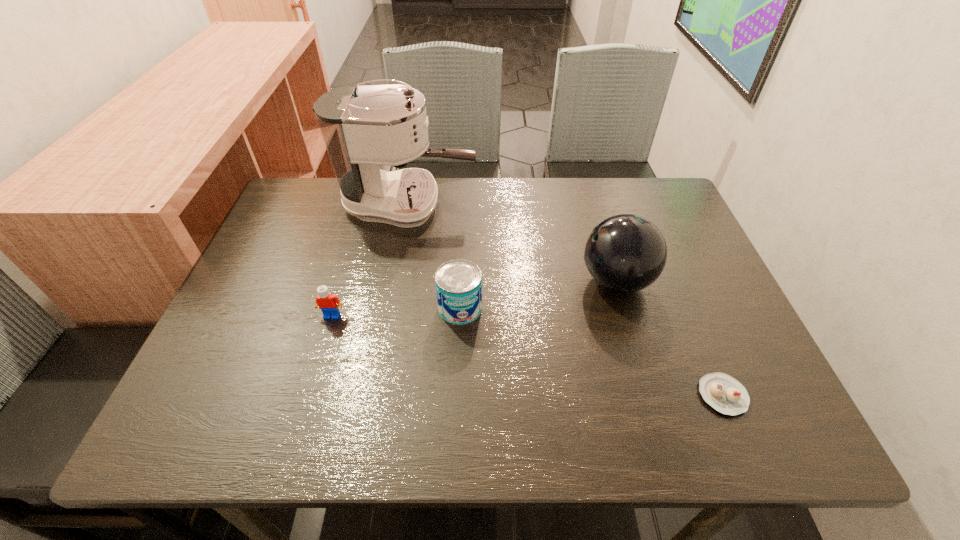
Where is `free space at the far edge of the desktop`? The width and height of the screenshot is (960, 540). free space at the far edge of the desktop is located at coordinates (492, 183).

Where is `vacant space at the near edge of the desktop`? This screenshot has height=540, width=960. vacant space at the near edge of the desktop is located at coordinates (445, 436).

In order to click on free point at the left edge in this screenshot , I will do `click(223, 397)`.

In the image, there is a desktop. Identify the location of free space at the right edge. (696, 288).

The width and height of the screenshot is (960, 540). I want to click on blank space at the far right corner, so click(x=655, y=178).

Find the location of a particular element. The image size is (960, 540). free space between the rightmost object and the tallest object is located at coordinates (565, 300).

The height and width of the screenshot is (540, 960). I want to click on free spot between the nearest object and the Lego, so click(x=527, y=355).

The image size is (960, 540). Find the location of `vacant area that lies between the can and the Lego`. vacant area that lies between the can and the Lego is located at coordinates (396, 312).

Where is `vacant space that's between the tallest object and the Lego`? This screenshot has height=540, width=960. vacant space that's between the tallest object and the Lego is located at coordinates (371, 260).

Find the location of `unoccupied position between the second object from right to left and the cupcake`. unoccupied position between the second object from right to left and the cupcake is located at coordinates (669, 338).